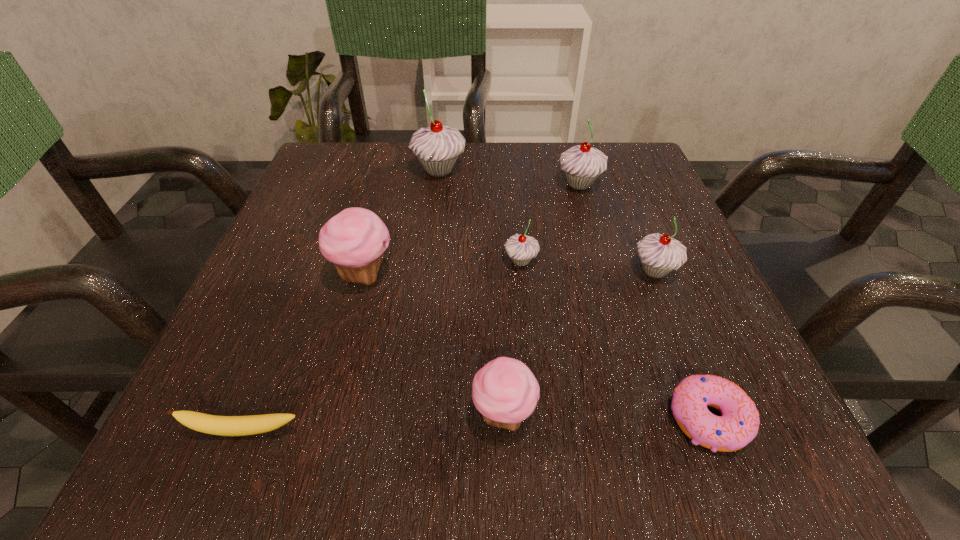
You are a GUI agent. You are given a task and a screenshot of the screen. Output one action in this format:
    pyautogui.click(x=<x>, y=<y>)
    Task: Click on the nearer pink cupcake
    
    Given the screenshot: What is the action you would take?
    pyautogui.click(x=505, y=391)

Image resolution: width=960 pixels, height=540 pixels. Identify the location of banana. (211, 424).

Where is `pink doughnut`? pink doughnut is located at coordinates (738, 426).

The height and width of the screenshot is (540, 960). I want to click on vacant area situated on the front of the tallest object, so click(x=429, y=252).

The width and height of the screenshot is (960, 540). What are the coordinates of `free space located on the front of the seventh shortest object` in the screenshot? It's located at (623, 339).

Where is `vacant space located on the back of the farther pink cupcake`? This screenshot has height=540, width=960. vacant space located on the back of the farther pink cupcake is located at coordinates (396, 150).

Locate an element on the screen. free spot located on the back of the rightmost gray cupcake is located at coordinates (610, 158).

Identify the location of vacant position located 0.060m on the right of the smallest gray cupcake. This screenshot has height=540, width=960. (573, 261).

Identify the location of free space located on the back of the smaller pink cupcake. The height and width of the screenshot is (540, 960). (501, 356).

What are the coordinates of `free space located 0.140m on the left of the doughnut` in the screenshot? It's located at (558, 419).